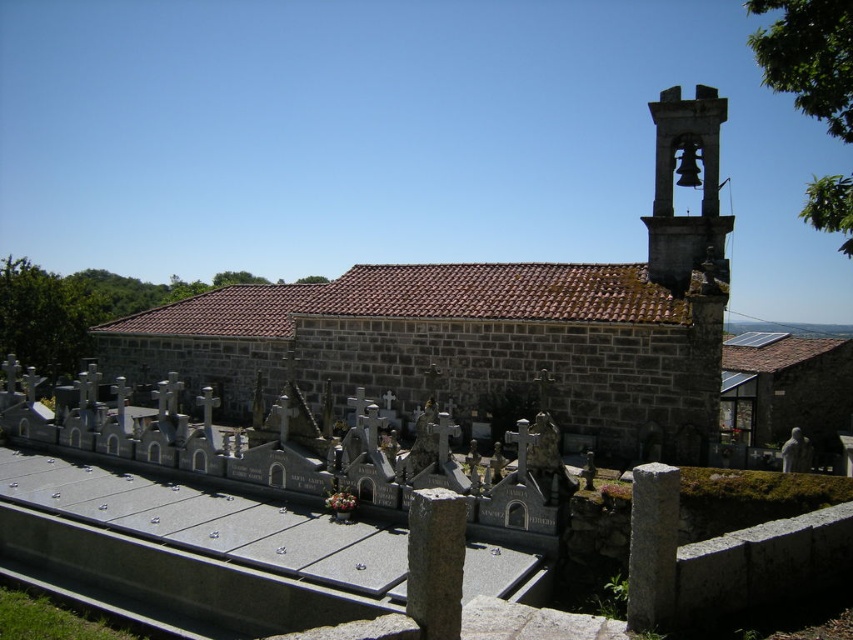
Question: Is brown stone church at center above matte gray stone bell tower at upper right?

Choices:
 (A) no
 (B) yes

Answer: (A)

Question: Which of the following is the closest to the observer?

Choices:
 (A) (683, 176)
 (B) (683, 404)

Answer: (B)

Question: Is brown stone church at center further to the viewer compared to matte gray stone bell tower at upper right?

Choices:
 (A) no
 (B) yes

Answer: (A)

Question: Does brown stone church at center have a larger size compared to matte gray stone bell tower at upper right?

Choices:
 (A) yes
 (B) no

Answer: (A)

Question: Which object appears farthest from the camera in this image?

Choices:
 (A) brown stone church at center
 (B) matte gray stone bell tower at upper right

Answer: (B)